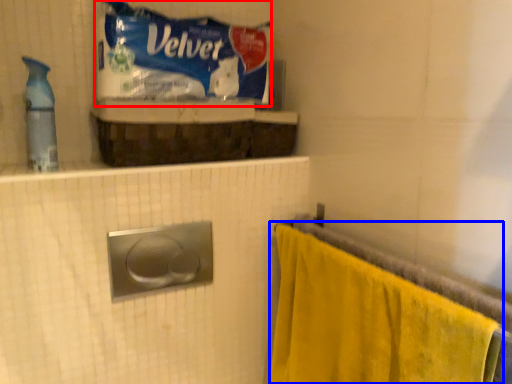
Question: Which object appears closest to the camera in this image, material (highlighted by a red box) or towel (highlighted by a blue box)?

Choices:
 (A) material
 (B) towel

Answer: (B)